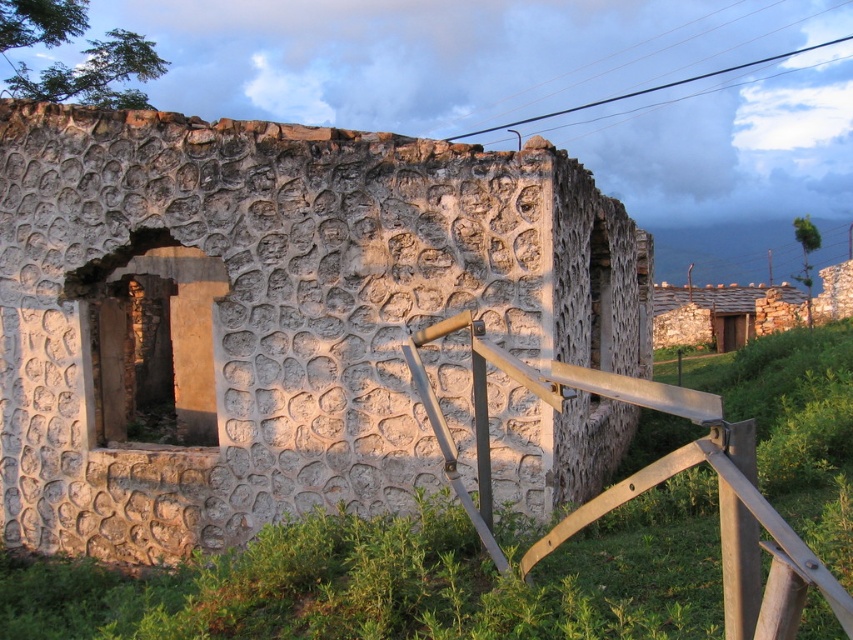
You are standing in front of the ruins and want to place a small potted plant between the rough stone wall at center and the metallic silver rail at lower right. Based on their positions, where should you place the plant so it is between them?

The rough stone wall at center is above the metallic silver rail at lower right, so placing the plant between them would require positioning it below the rough stone wall at center and above the metallic silver rail at lower right.

You are standing in front of the ruined stone structure. You see the metallic silver rail at lower right and the stone roof hut at upper right. Which object is positioned higher from the ground?

The stone roof hut at upper right is positioned higher from the ground than the metallic silver rail at lower right.